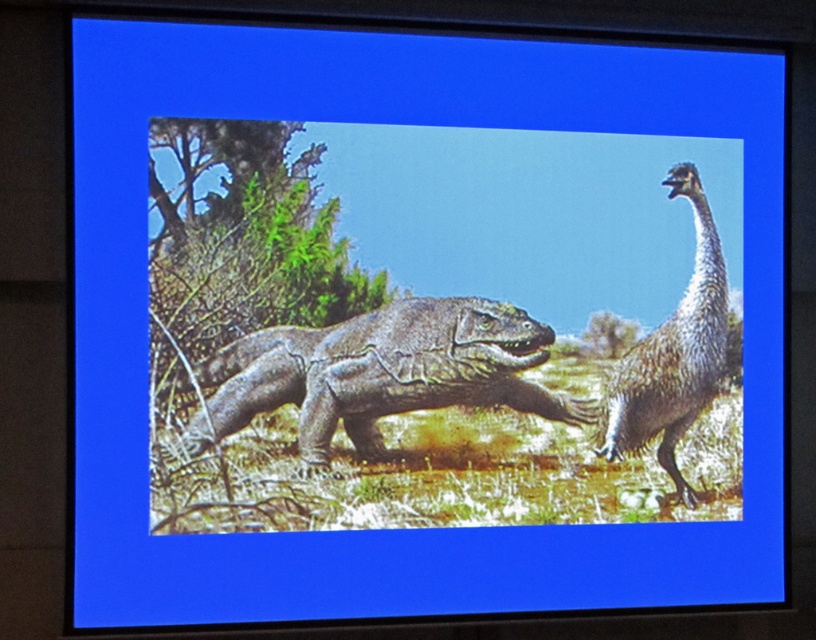
From the picture: You are a paleontologist examining a digital reconstruction of a prehistoric scene. You notice two dinosaurs in the image. The gray scaly dinosaur at center and the gray textured dinosaur at right. Based on their positions, which dinosaur is closer to the ground?

The gray scaly dinosaur at center is closer to the ground because it is positioned below the gray textured dinosaur at right.